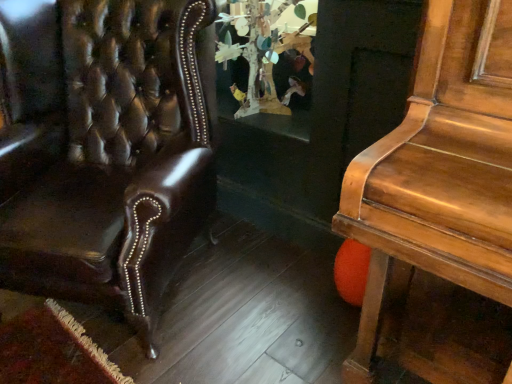
What do you see at coordinates (270, 66) in the screenshot? The height and width of the screenshot is (384, 512). I see `wooden tree sculpture at center` at bounding box center [270, 66].

Locate an element on the screen. The image size is (512, 384). wooden tree sculpture at center is located at coordinates (270, 66).

What is the approximate height of shiny brown leather chair at left?

shiny brown leather chair at left is 1.05 meters tall.

Find the location of a particular element. This screenshot has height=384, width=512. shiny brown leather chair at left is located at coordinates (105, 148).

The width and height of the screenshot is (512, 384). What do you see at coordinates (105, 148) in the screenshot? I see `shiny brown leather chair at left` at bounding box center [105, 148].

Identify the location of wooden tree sculpture at center. The image size is (512, 384). (270, 66).

From the picture: Is shiny brown leather chair at left to the left of wooden tree sculpture at center from the viewer's perspective?

Indeed, shiny brown leather chair at left is positioned on the left side of wooden tree sculpture at center.

Who is more distant, shiny brown leather chair at left or wooden tree sculpture at center?

wooden tree sculpture at center is more distant.

Considering the positions of point (50, 223) and point (296, 89), is point (50, 223) closer or farther from the camera than point (296, 89)?

Point (50, 223) is positioned closer to the camera compared to point (296, 89).

From the image's perspective, which object appears higher, shiny brown leather chair at left or wooden tree sculpture at center?

wooden tree sculpture at center.

From a real-world perspective, is shiny brown leather chair at left physically located above or below wooden tree sculpture at center?

shiny brown leather chair at left is situated lower than wooden tree sculpture at center in the real world.

Between shiny brown leather chair at left and wooden tree sculpture at center, which one has larger width?

shiny brown leather chair at left.

Considering the sizes of objects shiny brown leather chair at left and wooden tree sculpture at center in the image provided, who is shorter, shiny brown leather chair at left or wooden tree sculpture at center?

wooden tree sculpture at center is shorter.

Between shiny brown leather chair at left and wooden tree sculpture at center, which one has smaller size?

Smaller between the two is wooden tree sculpture at center.

Based on the photo, is shiny brown leather chair at left positioned beyond the bounds of wooden tree sculpture at center?

shiny brown leather chair at left is positioned outside wooden tree sculpture at center.

Is shiny brown leather chair at left directly adjacent to wooden tree sculpture at center?

shiny brown leather chair at left is not next to wooden tree sculpture at center, and they're not touching.

Is shiny brown leather chair at left positioned with its back to wooden tree sculpture at center?

That's right, shiny brown leather chair at left is facing away from wooden tree sculpture at center.

Can you tell me how much shiny brown leather chair at left and wooden tree sculpture at center differ in facing direction?

shiny brown leather chair at left and wooden tree sculpture at center are facing 30.4 degrees away from each other.

The height and width of the screenshot is (384, 512). In order to click on chair below the wooden tree sculpture at center (from a real-world perspective) in this screenshot , I will do `click(105, 148)`.

Considering the positions of objects wooden tree sculpture at center and shiny brown leather chair at left in the image provided, who is more to the right, wooden tree sculpture at center or shiny brown leather chair at left?

Positioned to the right is wooden tree sculpture at center.

Who is more distant, wooden tree sculpture at center or shiny brown leather chair at left?

Positioned behind is wooden tree sculpture at center.

Is point (241, 12) positioned behind point (126, 83)?

Yes, point (241, 12) is farther from viewer.

From the image's perspective, is wooden tree sculpture at center beneath shiny brown leather chair at left?

No, from the image's perspective, wooden tree sculpture at center is not below shiny brown leather chair at left.

From a real-world perspective, which object stands above the other?

wooden tree sculpture at center, from a real-world perspective.

Can you confirm if wooden tree sculpture at center is thinner than shiny brown leather chair at left?

Indeed, wooden tree sculpture at center has a lesser width compared to shiny brown leather chair at left.

Is wooden tree sculpture at center shorter than shiny brown leather chair at left?

Correct, wooden tree sculpture at center is not as tall as shiny brown leather chair at left.

Based on the photo, who is bigger, wooden tree sculpture at center or shiny brown leather chair at left?

shiny brown leather chair at left is bigger.

Would you say wooden tree sculpture at center is outside shiny brown leather chair at left?

Yes, wooden tree sculpture at center is located beyond the bounds of shiny brown leather chair at left.

Is wooden tree sculpture at center far away from shiny brown leather chair at left?

That's not correct — wooden tree sculpture at center is a little close to shiny brown leather chair at left.

Is wooden tree sculpture at center oriented away from shiny brown leather chair at left?

No, wooden tree sculpture at center is not facing the opposite direction of shiny brown leather chair at left.

Measure the distance from wooden tree sculpture at center to shiny brown leather chair at left.

wooden tree sculpture at center is 24.74 inches away from shiny brown leather chair at left.

Where is `chair on the left of wooden tree sculpture at center`? The image size is (512, 384). chair on the left of wooden tree sculpture at center is located at coordinates (105, 148).

The width and height of the screenshot is (512, 384). Find the location of `shop window behind the shiny brown leather chair at left`. shop window behind the shiny brown leather chair at left is located at coordinates (270, 66).

Where is `chair that is on the left side of wooden tree sculpture at center`? Image resolution: width=512 pixels, height=384 pixels. chair that is on the left side of wooden tree sculpture at center is located at coordinates (105, 148).